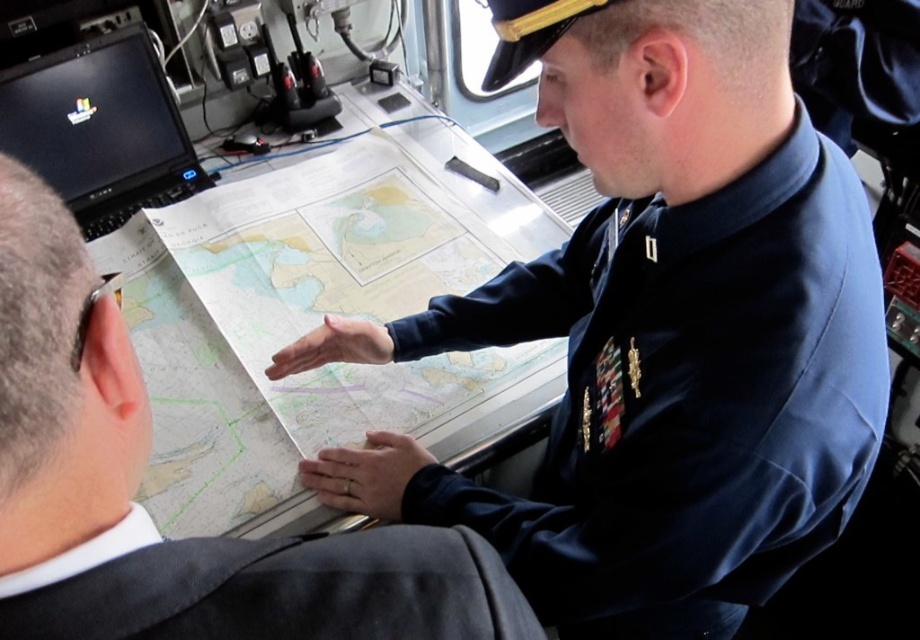
Question: Which of the following is the closest to the observer?

Choices:
 (A) gray fabric suit at lower left
 (B) blue uniform at center
 (C) white paper map at center
 (D) black glossy laptop at upper left

Answer: (A)

Question: Which of these objects is positioned closest to the black glossy laptop at upper left?

Choices:
 (A) blue uniform at center
 (B) gray fabric suit at lower left

Answer: (A)

Question: Is gray fabric suit at lower left further to camera compared to black glossy laptop at upper left?

Choices:
 (A) yes
 (B) no

Answer: (B)

Question: Does blue uniform at center have a larger size compared to gray fabric suit at lower left?

Choices:
 (A) no
 (B) yes

Answer: (B)

Question: Is blue uniform at center above gray fabric suit at lower left?

Choices:
 (A) yes
 (B) no

Answer: (A)

Question: Which object appears closest to the camera in this image?

Choices:
 (A) black glossy laptop at upper left
 (B) white paper map at center

Answer: (B)